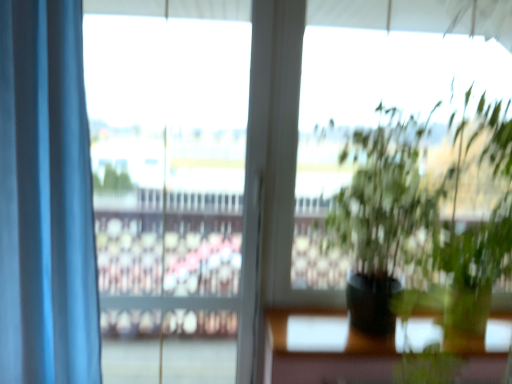
Question: Looking at their shapes, would you say blue fabric curtain at left is wider or thinner than clear glass window at center?

Choices:
 (A) thin
 (B) wide

Answer: (B)

Question: Considering the positions of blue fabric curtain at left and clear glass window at center in the image, is blue fabric curtain at left taller or shorter than clear glass window at center?

Choices:
 (A) short
 (B) tall

Answer: (A)

Question: From a real-world perspective, is blue fabric curtain at left physically located above or below clear glass window at center?

Choices:
 (A) above
 (B) below

Answer: (A)

Question: In terms of height, does clear glass window at center look taller or shorter compared to blue fabric curtain at left?

Choices:
 (A) short
 (B) tall

Answer: (B)

Question: Is clear glass window at center inside or outside of blue fabric curtain at left?

Choices:
 (A) inside
 (B) outside

Answer: (B)

Question: Is point (132, 231) closer or farther from the camera than point (49, 137)?

Choices:
 (A) closer
 (B) farther

Answer: (B)

Question: Based on their positions, is clear glass window at center located to the left or right of blue fabric curtain at left?

Choices:
 (A) left
 (B) right

Answer: (B)